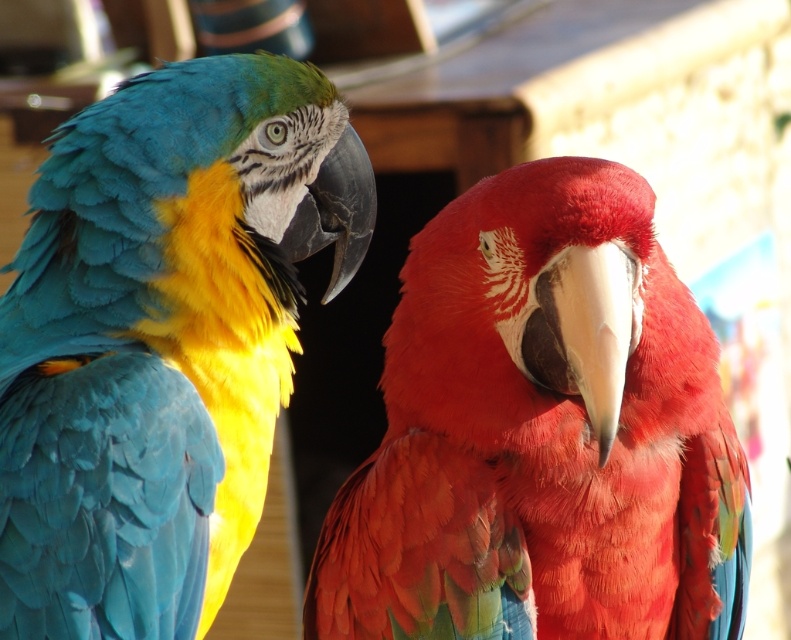
You are a photographer aiming to capture the red parrot at center in a closeup shot. You are currently positioned at point (542, 433). Can you confirm if this is the correct location to focus your camera?

Yes, the point (542, 433) is where the shiny red parrot at center is located, so focusing there will capture it in your closeup shot.

You are a photographer who wants to capture a photo of the shiny blue feathers at left and the shiny red parrot at center. Based on their positions, which object should you focus on first if you want to ensure both are in frame?

The shiny red parrot at center is to the right of the shiny blue feathers at left, so you should focus on the shiny blue feathers at left first to ensure both are in frame.